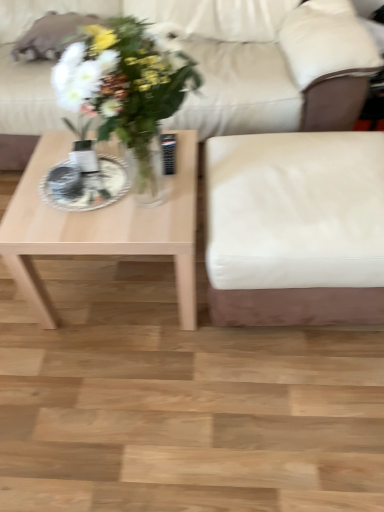
You are a GUI agent. You are given a task and a screenshot of the screen. Output one action in this format:
    pyautogui.click(x=<x>, y=<y>)
    Task: Click on the vacant space underneath light wood coffee table at left (from a real-world perspective)
    
    Given the screenshot: What is the action you would take?
    pyautogui.click(x=121, y=282)